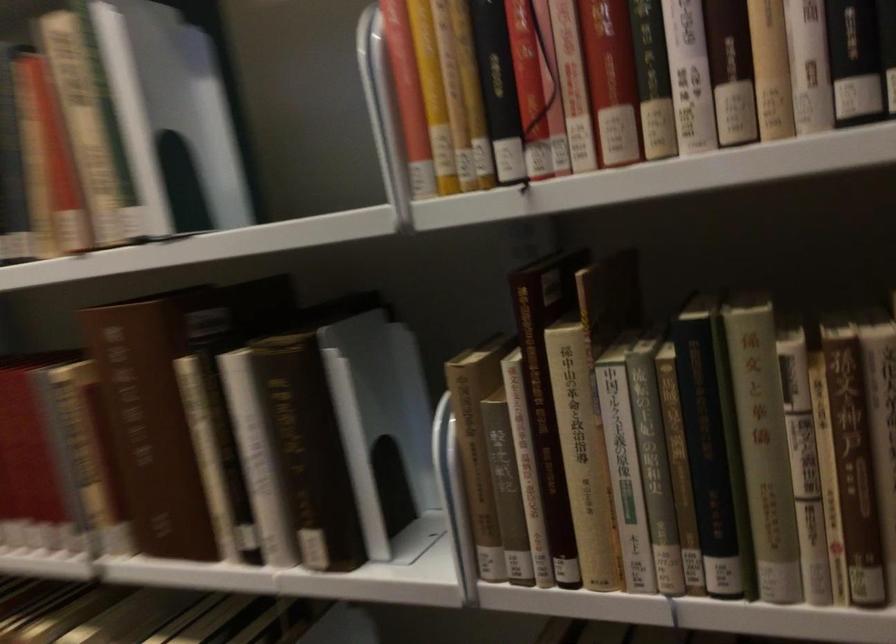
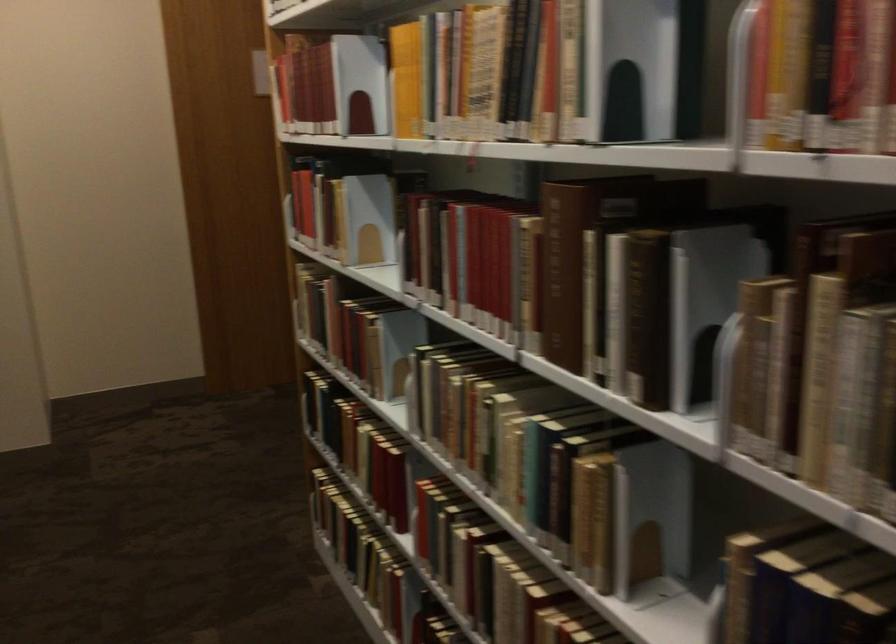
Find the pixel in the second image that matches [472,471] in the first image.

(743, 363)